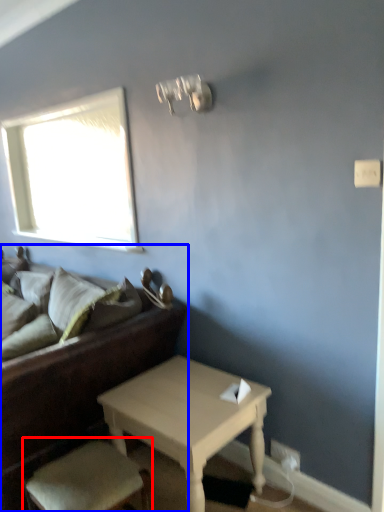
Question: Which object appears farthest to the camera in this image, armchair (highlighted by a red box) or studio couch (highlighted by a blue box)?

Choices:
 (A) armchair
 (B) studio couch

Answer: (B)